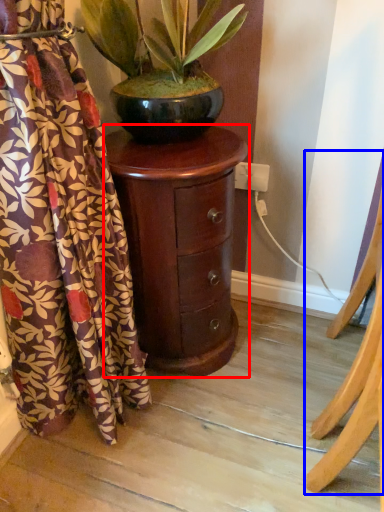
Question: Which object is further to the camera taking this photo, nightstand (highlighted by a red box) or furniture (highlighted by a blue box)?

Choices:
 (A) nightstand
 (B) furniture

Answer: (A)